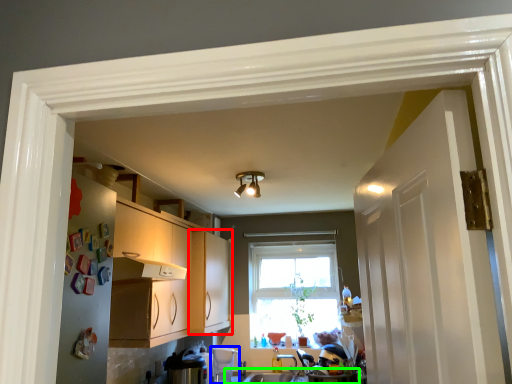
Question: Based on their relative distances, which object is nearer to cabinetry (highlighted by a red box)? Choose from appliance (highlighted by a blue box) and counter top (highlighted by a green box).

Choices:
 (A) appliance
 (B) counter top

Answer: (A)